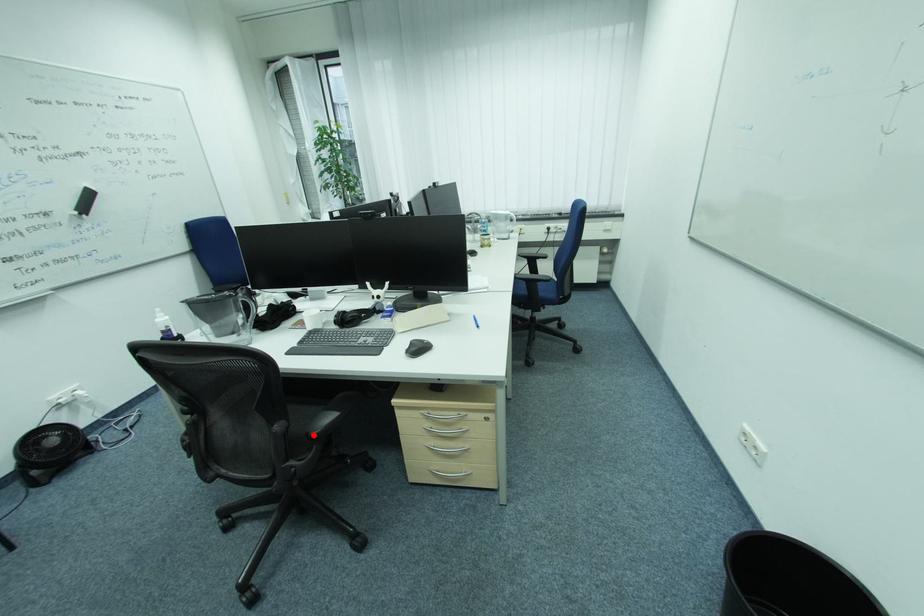
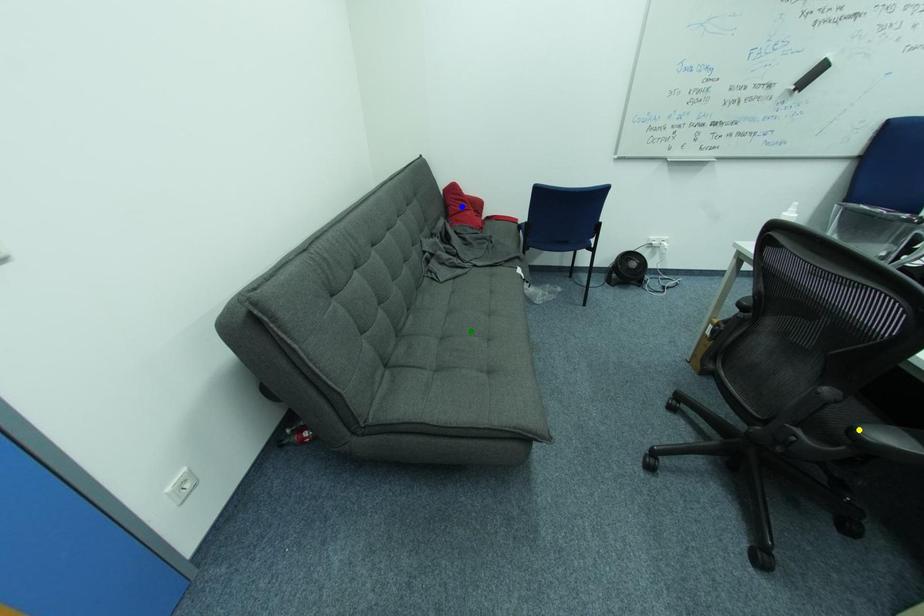
Question: I am providing you with two images of the same scene from different viewpoints. A red point is marked on the first image. You are given multiple points on the second image. In image 2, which mark is for the same physical point as the one in image 1?

Choices:
 (A) yellow point
 (B) blue point
 (C) green point

Answer: (A)